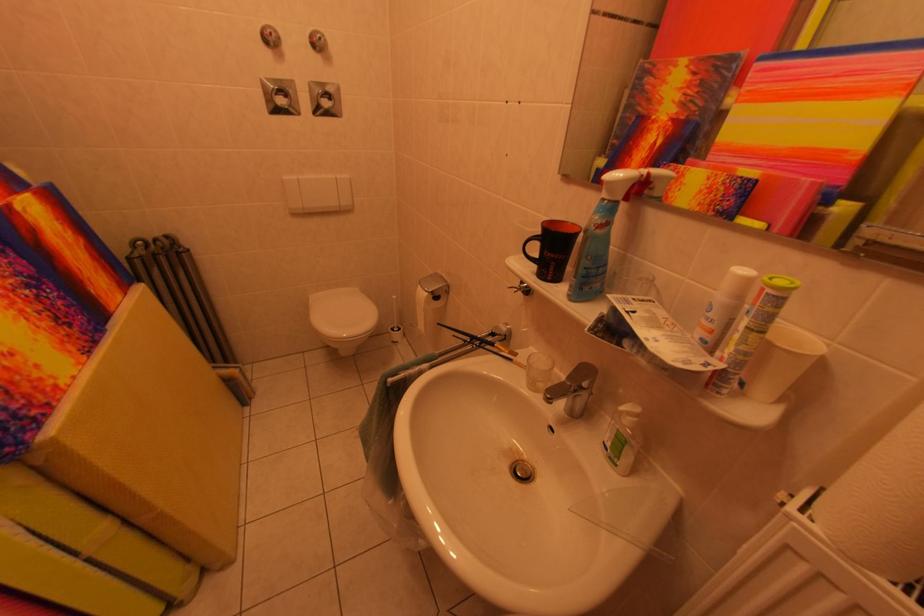
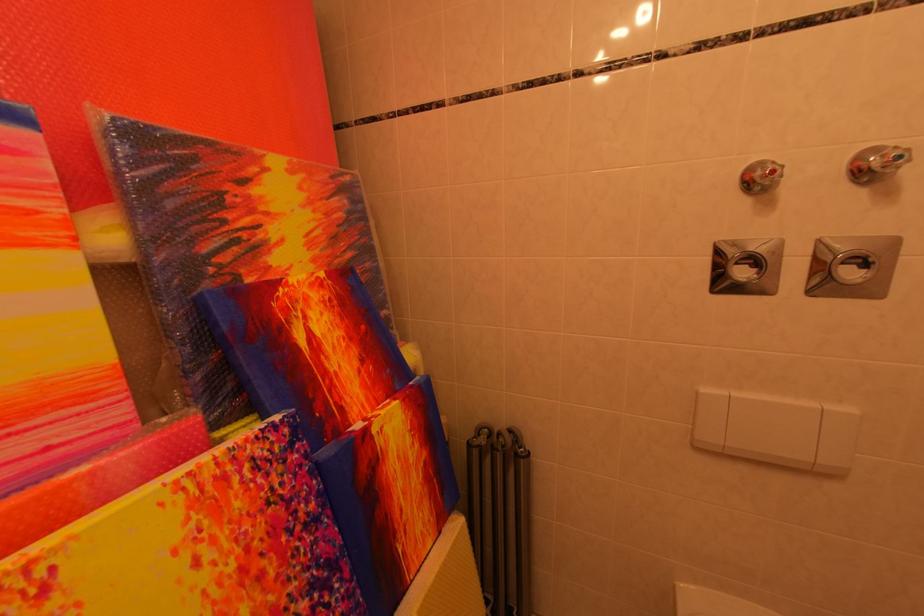
Question: The camera is either moving clockwise (left) or counter-clockwise (right) around the object. The first image is from the beginning of the video and the second image is from the end. Is the camera moving left or right when shooting the video?

Choices:
 (A) Left
 (B) Right

Answer: (B)